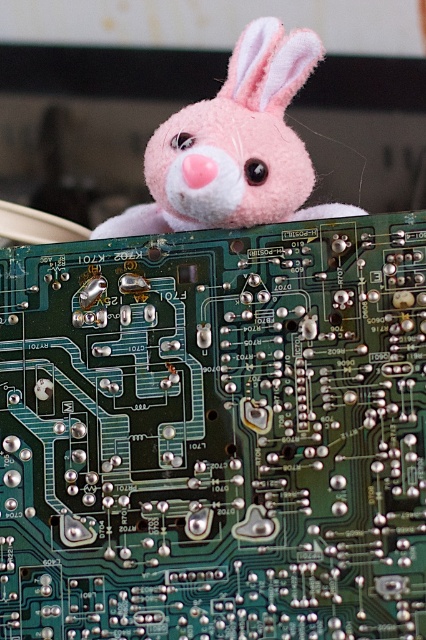
Is green printed circuit board at center smaller than pink plush toy at upper center?

Indeed, green printed circuit board at center has a smaller size compared to pink plush toy at upper center.

Is green printed circuit board at center further to the viewer compared to pink plush toy at upper center?

Yes, it is.

Is point (252, 356) in front of point (235, 212)?

That is False.

At what (x,y) coordinates should I click in order to perform the action: click on green printed circuit board at center. Please return your answer as a coordinate pair (x, y). Image resolution: width=426 pixels, height=640 pixels. Looking at the image, I should click on (215, 435).